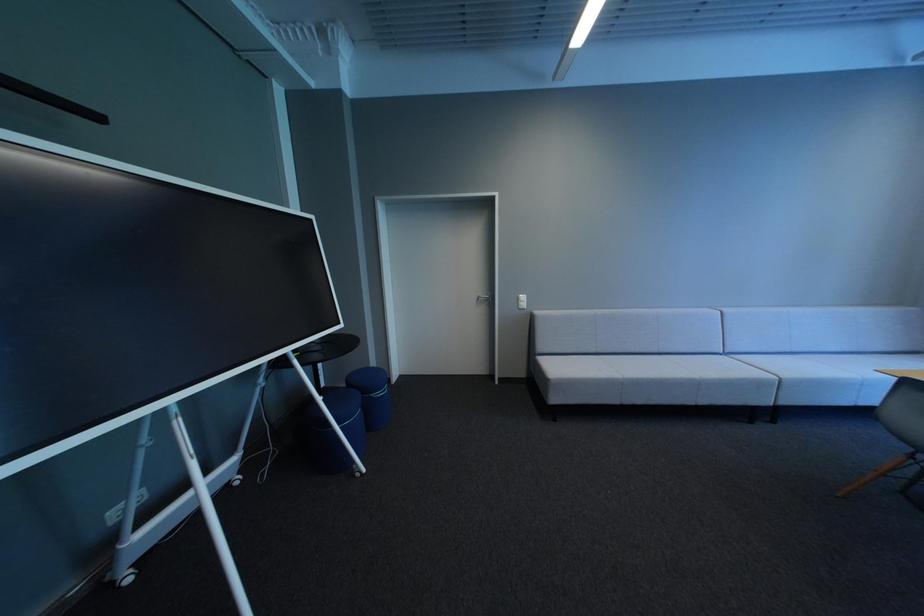
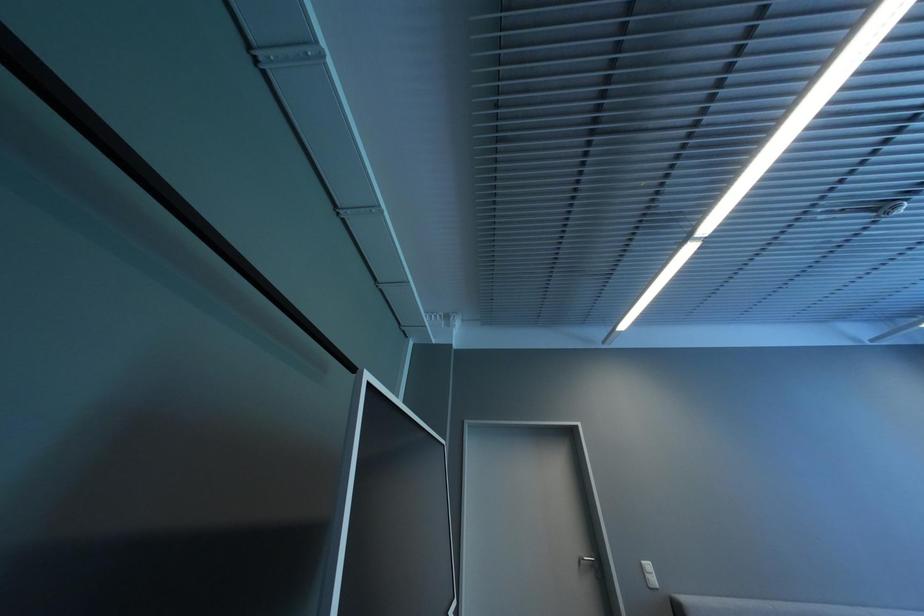
Question: The first image is from the beginning of the video and the second image is from the end. How did the camera likely rotate when shooting the video?

Choices:
 (A) Left
 (B) Right
 (C) Up
 (D) Down

Answer: (C)